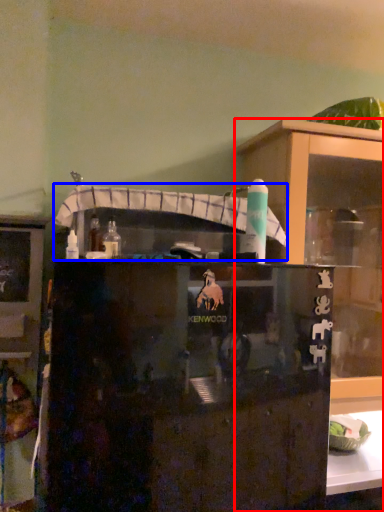
Question: Which object appears farthest to the camera in this image, cupboard (highlighted by a red box) or shelf (highlighted by a blue box)?

Choices:
 (A) cupboard
 (B) shelf

Answer: (A)